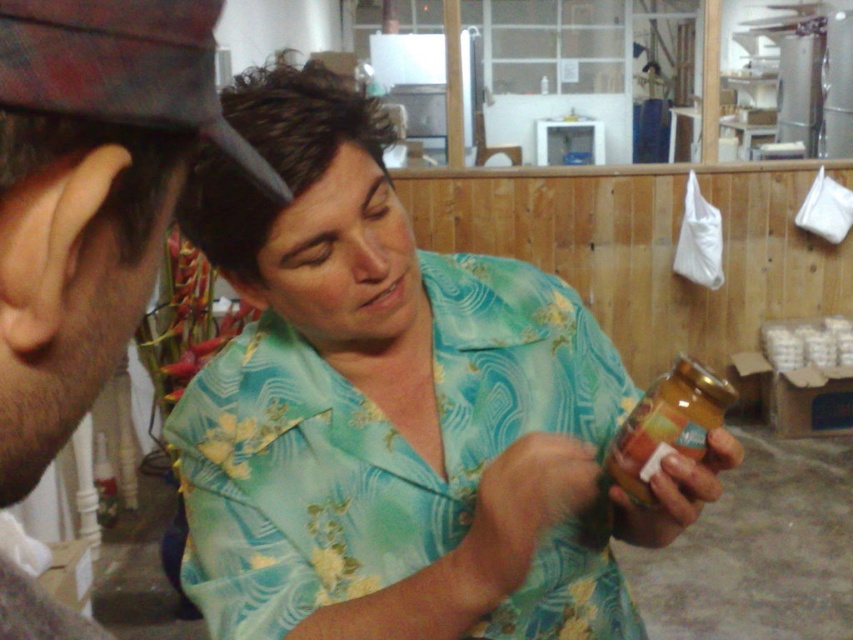
Question: Which object is farther from the camera taking this photo?

Choices:
 (A) translucent plastic jar at center
 (B) translucent glass jar at center
 (C) matte black comb at upper left

Answer: (B)

Question: Does fluffy brown hair at center appear on the right side of translucent plastic jar at center?

Choices:
 (A) no
 (B) yes

Answer: (A)

Question: Among these points, which one is nearest to the camera?

Choices:
 (A) (619, 486)
 (B) (668, 544)
 (C) (590, 474)

Answer: (C)

Question: Which object is positioned farthest from the brown hair at left?

Choices:
 (A) matte black comb at upper left
 (B) translucent glass jar at lower center
 (C) translucent plastic jar at center

Answer: (C)

Question: Is fluffy brown hair at center to the right of translucent glass jar at lower center from the viewer's perspective?

Choices:
 (A) yes
 (B) no

Answer: (B)

Question: Is brown hair at left in front of fluffy brown hair at center?

Choices:
 (A) yes
 (B) no

Answer: (A)